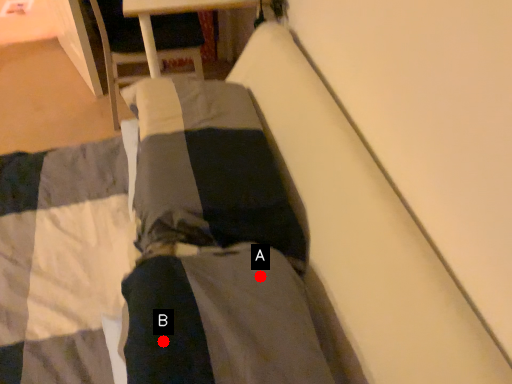
Question: Two points are circled on the image, labeled by A and B beside each circle. Which point is closer to the camera?

Choices:
 (A) A is closer
 (B) B is closer

Answer: (B)